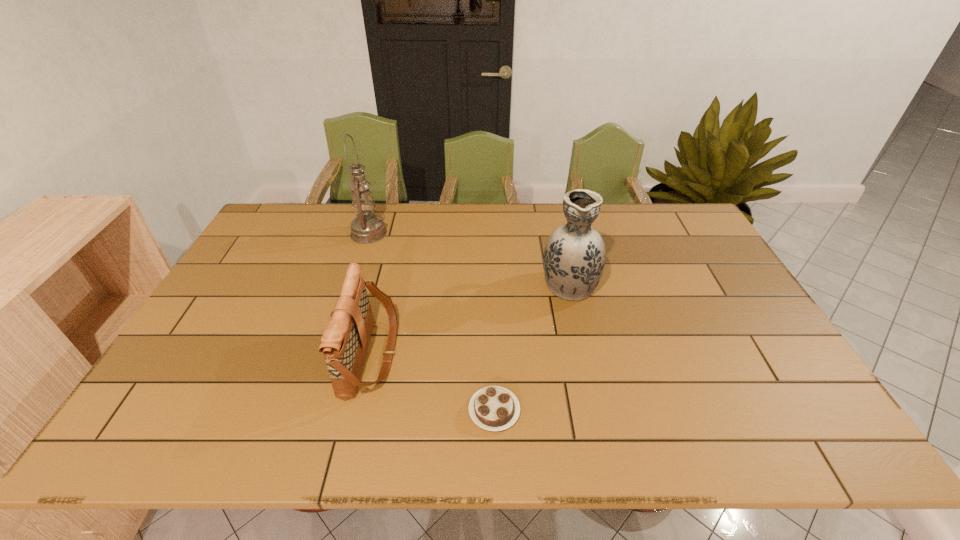
Where is `free space located with the handle on the side of the third shortest object`? free space located with the handle on the side of the third shortest object is located at coordinates (554, 216).

Locate an element on the screen. Image resolution: width=960 pixels, height=540 pixels. blank space located 0.210m on the front-facing side of the third tallest object is located at coordinates (477, 354).

This screenshot has width=960, height=540. In order to click on vacant position located 0.280m on the back of the third object from left to right in this screenshot , I will do `click(492, 306)`.

At what (x,y) coordinates should I click in order to perform the action: click on object at the far edge. Please return your answer as a coordinate pair (x, y). The height and width of the screenshot is (540, 960). Looking at the image, I should click on (366, 228).

Image resolution: width=960 pixels, height=540 pixels. I want to click on object that is positioned at the near edge, so 494,408.

Locate an element on the screen. This screenshot has height=540, width=960. free space at the far edge of the desktop is located at coordinates (479, 224).

You are a GUI agent. You are given a task and a screenshot of the screen. Output one action in this format:
    pyautogui.click(x=<x>, y=<y>)
    Task: Click on the vacant space at the near edge of the desktop
    Image resolution: width=960 pixels, height=540 pixels.
    Given the screenshot: What is the action you would take?
    tap(458, 437)

Identify the location of free spot at the left edge of the desktop. The width and height of the screenshot is (960, 540). (239, 347).

In the image, there is a desktop. At what (x,y) coordinates should I click in order to perform the action: click on vacant region at the right edge. Please return your answer as a coordinate pair (x, y). This screenshot has width=960, height=540. Looking at the image, I should click on (715, 294).

This screenshot has height=540, width=960. I want to click on vacant point at the near left corner, so click(159, 426).